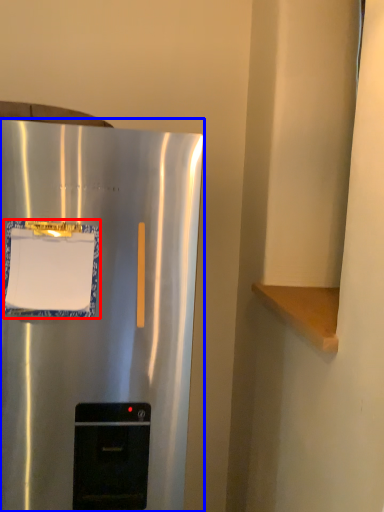
Question: Which of the following is the farthest to the observer, paper (highlighted by a red box) or refrigerator (highlighted by a blue box)?

Choices:
 (A) paper
 (B) refrigerator

Answer: (A)